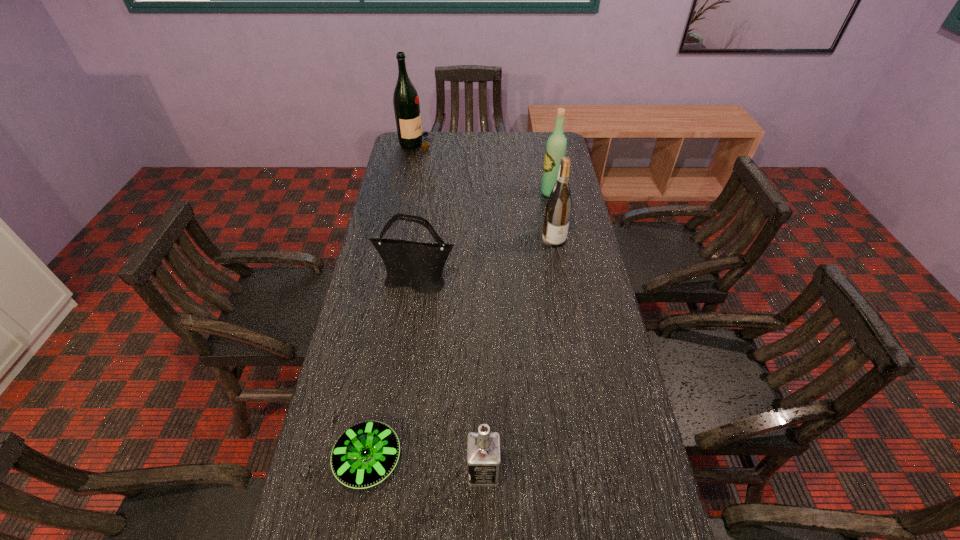
Where is `wine bottle that is at the left edge`? Image resolution: width=960 pixels, height=540 pixels. wine bottle that is at the left edge is located at coordinates (405, 99).

This screenshot has width=960, height=540. I want to click on shoulder bag that is at the left edge, so click(419, 266).

This screenshot has height=540, width=960. I want to click on saucer that is at the left edge, so click(x=364, y=455).

You are a GUI agent. You are given a task and a screenshot of the screen. Output one action in this format:
    pyautogui.click(x=<x>, y=<y>)
    Task: Click on the object that is at the far left corner
    The height and width of the screenshot is (540, 960).
    Given the screenshot: What is the action you would take?
    pyautogui.click(x=405, y=99)

In the image, there is a desktop. Where is `vacant space at the far edge`? vacant space at the far edge is located at coordinates (510, 135).

In the image, there is a desktop. Where is `vacant region at the left edge`? This screenshot has width=960, height=540. vacant region at the left edge is located at coordinates (412, 176).

This screenshot has height=540, width=960. In order to click on free spot at the right edge of the desktop in this screenshot , I will do `click(582, 373)`.

Where is `unoccupied area between the saucer and the fourth object from left to right`? This screenshot has width=960, height=540. unoccupied area between the saucer and the fourth object from left to right is located at coordinates (426, 466).

This screenshot has height=540, width=960. In order to click on vacant space that is in between the second nearest wine bottle and the shortest object in this screenshot , I will do coord(460,326).

At what (x,y) coordinates should I click in order to perform the action: click on unoccupied area between the fourth object from left to right and the fourth nearest object. Please return your answer as a coordinate pair (x, y). The height and width of the screenshot is (540, 960). Looking at the image, I should click on (518, 355).